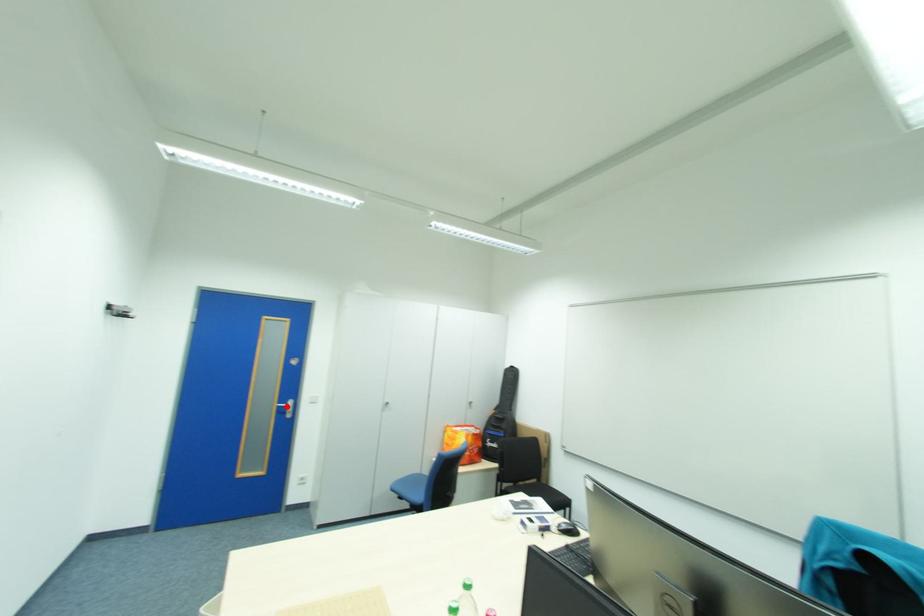
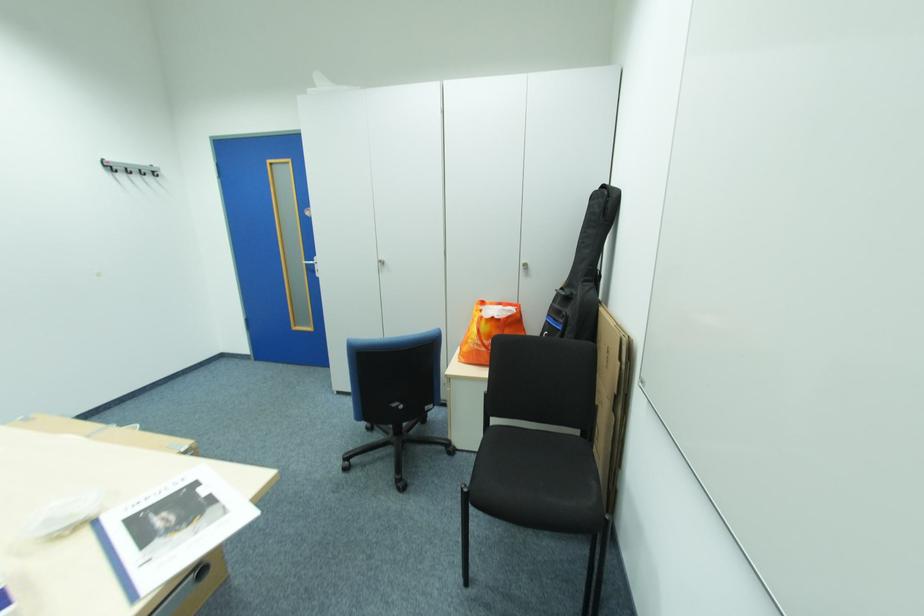
In the second image, find the point that corresponds to the highlighted location in the first image.

(314, 265)